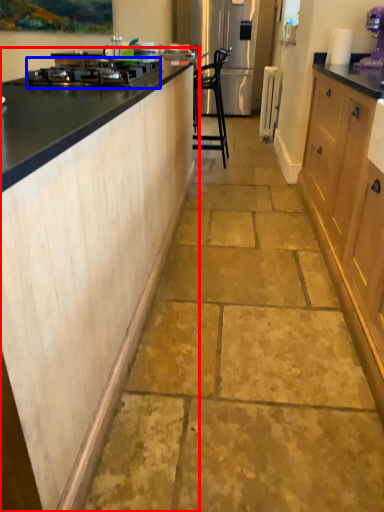
Question: Among these objects, which one is nearest to the camera, cabinetry (highlighted by a red box) or home appliance (highlighted by a blue box)?

Choices:
 (A) cabinetry
 (B) home appliance

Answer: (A)